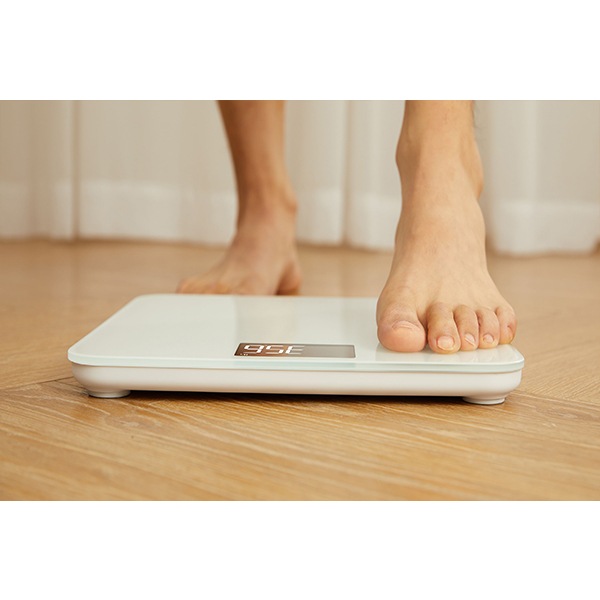
What are the coordinates of `light hardwood flooring` in the screenshot? It's located at (541, 435).